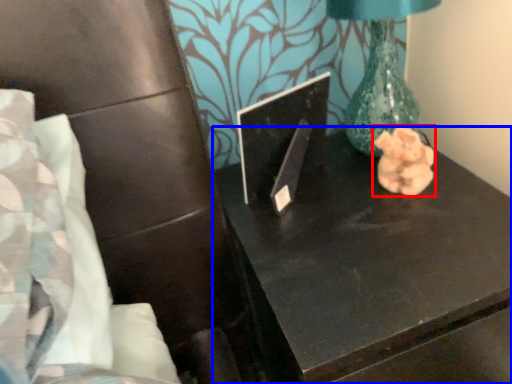
Question: Which object is further to the camera taking this photo, animal (highlighted by a red box) or table (highlighted by a blue box)?

Choices:
 (A) animal
 (B) table

Answer: (A)